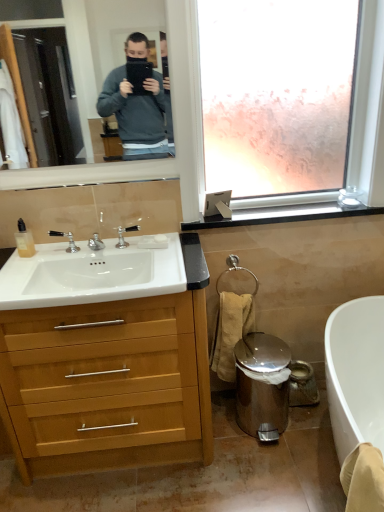
Locate an element on the screen. free space above black plastic window sill at upper right (from a real-world perspective) is located at coordinates (284, 208).